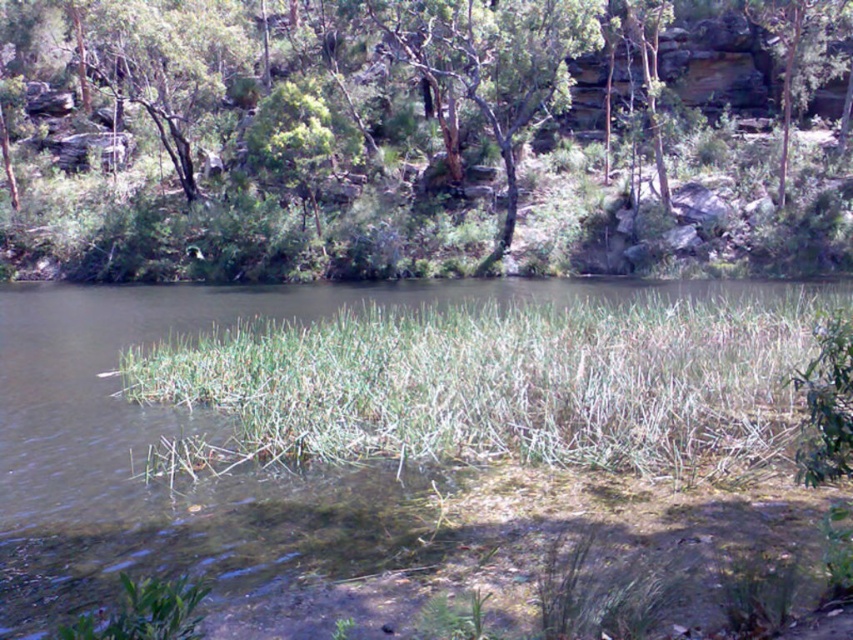
You are standing in the middle of the scene and want to walk towards the green leafy tree at upper center and the green fibrous grass at center. Which object will you encounter first?

You will encounter the green fibrous grass at center first because it is closer to you than the green leafy tree at upper center, which is further away.

You are standing at the point with coordinates point (x=409, y=140) in the scene. What object is located at that position?

The point (x=409, y=140) corresponds to the green leafy tree at upper center.